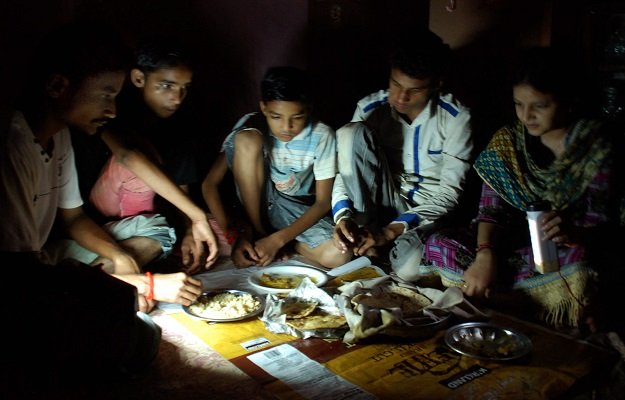
The image size is (625, 400). Find the location of `makeshift floor table`. makeshift floor table is located at coordinates (315, 348).